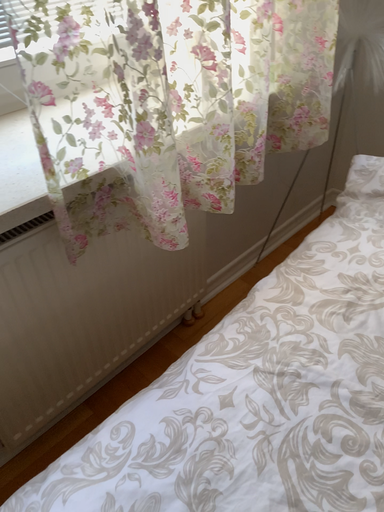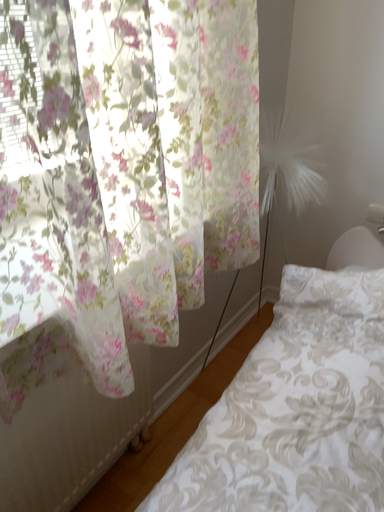
Question: Which way did the camera rotate in the video?

Choices:
 (A) rotated right
 (B) rotated left

Answer: (A)